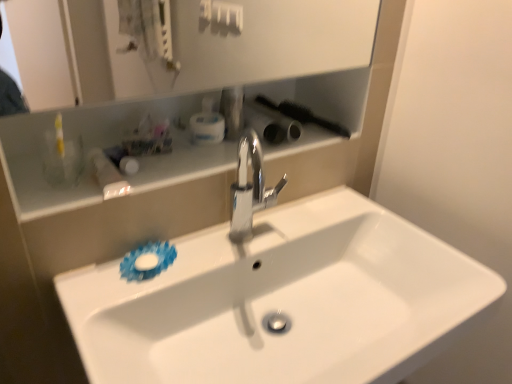
This screenshot has width=512, height=384. What do you see at coordinates (250, 187) in the screenshot?
I see `polished chrome faucet at center` at bounding box center [250, 187].

How much space does white plastic container at upper center, positioned as the second toiletry in left-to-right order, occupy horizontally?

It is 4.25 inches.

What is the approximate width of white glossy bottle at upper left, which appears as the 3th toiletry when viewed from the right?

10.17 inches.

The width and height of the screenshot is (512, 384). Identify the location of white glossy sink at center. (283, 301).

Locate an element on the screen. The height and width of the screenshot is (384, 512). metallic silver faucet at center, the 1th toiletry from the right is located at coordinates (232, 111).

What is the approximate width of metallic silver faucet at center, the 1th toiletry from the right?

→ metallic silver faucet at center, the 1th toiletry from the right, is 3.04 inches in width.

Find the location of a particular element. polished chrome faucet at center is located at coordinates (250, 187).

Is white glossy sink at center inside white glossy bottle at upper left, which appears as the 3th toiletry when viewed from the right?

No, white glossy bottle at upper left, which appears as the 3th toiletry when viewed from the right, does not contain white glossy sink at center.

From a real-world perspective, relative to white glossy sink at center, is white glossy bottle at upper left, which appears as the 3th toiletry when viewed from the right, vertically above or below?

white glossy bottle at upper left, which appears as the 3th toiletry when viewed from the right, is situated higher than white glossy sink at center in the real world.

In the scene shown: Looking at their sizes, would you say white glossy bottle at upper left, which appears as the 3th toiletry when viewed from the right, is wider or thinner than white glossy sink at center?

white glossy bottle at upper left, which appears as the 3th toiletry when viewed from the right, is thinner than white glossy sink at center.

At what (x,y) coordinates should I click in order to perform the action: click on sink that is below the white glossy bottle at upper left, placed as the 1th toiletry when sorted from left to right (from the image's perspective). Please return your answer as a coordinate pair (x, y). The width and height of the screenshot is (512, 384). Looking at the image, I should click on (283, 301).

Would you say white glossy sink at center is a long distance from metallic silver faucet at center, arranged as the third toiletry when viewed from the left?

No, white glossy sink at center is in close proximity to metallic silver faucet at center, arranged as the third toiletry when viewed from the left.

Is point (129, 327) positioned after point (236, 120)?

No, (129, 327) is in front of (236, 120).

Who is taller, white glossy sink at center or metallic silver faucet at center, arranged as the third toiletry when viewed from the left?

Standing taller between the two is white glossy sink at center.

Is white glossy sink at center facing away from metallic silver faucet at center, the 1th toiletry from the right?

No, white glossy sink at center is not facing away from metallic silver faucet at center, the 1th toiletry from the right.

Can you confirm if white glossy sink at center is bigger than white glossy shelf at upper center?

Indeed, white glossy sink at center has a larger size compared to white glossy shelf at upper center.

You are a GUI agent. You are given a task and a screenshot of the screen. Output one action in this format:
    pyautogui.click(x=<x>, y=<y>)
    Task: Click on the sink on the right of the white glossy shelf at upper center
    Image resolution: width=512 pixels, height=384 pixels.
    Given the screenshot: What is the action you would take?
    pyautogui.click(x=283, y=301)

Could you tell me if white glossy sink at center is facing white glossy shelf at upper center?

No.

Is white glossy sink at center situated inside white glossy shelf at upper center or outside?

white glossy sink at center lies outside white glossy shelf at upper center.

Visually, is white glossy sink at center positioned to the left or to the right of white glossy bottle at upper left, placed as the 1th toiletry when sorted from left to right?

From the image, it's evident that white glossy sink at center is to the right of white glossy bottle at upper left, placed as the 1th toiletry when sorted from left to right.

Between white glossy sink at center and white glossy bottle at upper left, which appears as the 3th toiletry when viewed from the right, which one has less height?

white glossy bottle at upper left, which appears as the 3th toiletry when viewed from the right.

How distant is white glossy sink at center from white glossy bottle at upper left, placed as the 1th toiletry when sorted from left to right?

They are 16.05 inches apart.

How many degrees apart are the facing directions of white glossy sink at center and white glossy bottle at upper left, which appears as the 3th toiletry when viewed from the right?

The angle between the facing direction of white glossy sink at center and the facing direction of white glossy bottle at upper left, which appears as the 3th toiletry when viewed from the right, is 1.68 degrees.

Is polished chrome faucet at center taller than white glossy sink at center?

No.

Considering the positions of objects polished chrome faucet at center and white glossy sink at center in the image provided, who is more to the right, polished chrome faucet at center or white glossy sink at center?

white glossy sink at center is more to the right.

Does point (238, 195) appear closer or farther from the camera than point (282, 215)?

Point (238, 195) appears to be closer to the viewer than point (282, 215).

Is white plastic container at upper center, positioned as the second toiletry in left-to-right order, inside white glossy sink at center?

No, white plastic container at upper center, positioned as the second toiletry in left-to-right order, is not a part of white glossy sink at center.

From the image's perspective, which one is positioned higher, white glossy sink at center or white plastic container at upper center, arranged as the 2th toiletry when viewed from the right?

white plastic container at upper center, arranged as the 2th toiletry when viewed from the right, from the image's perspective.

From a real-world perspective, who is located higher, white glossy sink at center or white plastic container at upper center, arranged as the 2th toiletry when viewed from the right?

white plastic container at upper center, arranged as the 2th toiletry when viewed from the right.

How many degrees apart are the facing directions of white glossy sink at center and white plastic container at upper center, positioned as the second toiletry in left-to-right order?

The angle between the facing direction of white glossy sink at center and the facing direction of white plastic container at upper center, positioned as the second toiletry in left-to-right order, is 5.04 degrees.

Considering the positions of objects metallic silver faucet at center, arranged as the third toiletry when viewed from the left, and white glossy shelf at upper center in the image provided, who is in front, metallic silver faucet at center, arranged as the third toiletry when viewed from the left, or white glossy shelf at upper center?

white glossy shelf at upper center.

Is metallic silver faucet at center, arranged as the third toiletry when viewed from the left, looking in the opposite direction of white glossy shelf at upper center?

No, white glossy shelf at upper center is not at the back of metallic silver faucet at center, arranged as the third toiletry when viewed from the left.

Is metallic silver faucet at center, arranged as the third toiletry when viewed from the left, taller than white glossy shelf at upper center?

Correct, metallic silver faucet at center, arranged as the third toiletry when viewed from the left, is much taller as white glossy shelf at upper center.

Is metallic silver faucet at center, the 1th toiletry from the right, positioned far away from white glossy shelf at upper center?

Actually, metallic silver faucet at center, the 1th toiletry from the right, and white glossy shelf at upper center are a little close together.

You are a GUI agent. You are given a task and a screenshot of the screen. Output one action in this format:
    pyautogui.click(x=<x>, y=<y>)
    Task: Click on the sink beneath the white glossy bottle at upper left, which appears as the 3th toiletry when viewed from the right (from a real-world perspective)
    
    Given the screenshot: What is the action you would take?
    pyautogui.click(x=283, y=301)

Locate an element on the screen. Image resolution: width=512 pixels, height=384 pixels. the 3rd toiletry positioned above the white glossy sink at center (from a real-world perspective) is located at coordinates (232, 111).

Considering their positions, is white glossy sink at center positioned closer to white glossy bottle at upper left, placed as the 1th toiletry when sorted from left to right, than polished chrome faucet at center?

Among the two, polished chrome faucet at center is located nearer to white glossy bottle at upper left, placed as the 1th toiletry when sorted from left to right.

Based on their spatial positions, is polished chrome faucet at center or white glossy sink at center closer to white glossy bottle at upper left, placed as the 1th toiletry when sorted from left to right?

Among the two, polished chrome faucet at center is located nearer to white glossy bottle at upper left, placed as the 1th toiletry when sorted from left to right.

When comparing their distances from white glossy bottle at upper left, placed as the 1th toiletry when sorted from left to right, does white glossy sink at center or white plastic container at upper center, positioned as the second toiletry in left-to-right order, seem further?

Among the two, white glossy sink at center is located further to white glossy bottle at upper left, placed as the 1th toiletry when sorted from left to right.

Considering their positions, is white glossy bottle at upper left, which appears as the 3th toiletry when viewed from the right, positioned further to metallic silver faucet at center, the 1th toiletry from the right, than white glossy sink at center?

The object further to metallic silver faucet at center, the 1th toiletry from the right, is white glossy sink at center.

Which object lies nearer to the anchor point white glossy shelf at upper center, white glossy sink at center or metallic silver faucet at center, the 1th toiletry from the right?

Based on the image, metallic silver faucet at center, the 1th toiletry from the right, appears to be nearer to white glossy shelf at upper center.

Based on their spatial positions, is metallic silver faucet at center, the 1th toiletry from the right, or white glossy shelf at upper center closer to polished chrome faucet at center?

Based on the image, metallic silver faucet at center, the 1th toiletry from the right, appears to be nearer to polished chrome faucet at center.

When comparing their distances from white glossy bottle at upper left, which appears as the 3th toiletry when viewed from the right, does white plastic container at upper center, positioned as the second toiletry in left-to-right order, or polished chrome faucet at center seem further?

Among the two, polished chrome faucet at center is located further to white glossy bottle at upper left, which appears as the 3th toiletry when viewed from the right.

Which object lies further to the anchor point white glossy shelf at upper center, white glossy bottle at upper left, which appears as the 3th toiletry when viewed from the right, or white plastic container at upper center, arranged as the 2th toiletry when viewed from the right?

Among the two, white glossy bottle at upper left, which appears as the 3th toiletry when viewed from the right, is located further to white glossy shelf at upper center.

Locate an element on the screen. This screenshot has height=384, width=512. shelve between white glossy bottle at upper left, which appears as the 3th toiletry when viewed from the right, and polished chrome faucet at center is located at coordinates (39, 170).

You are a GUI agent. You are given a task and a screenshot of the screen. Output one action in this format:
    pyautogui.click(x=<x>, y=<y>)
    Task: Click on the shelve situated between white glossy bottle at upper left, placed as the 1th toiletry when sorted from left to right, and metallic silver faucet at center, the 1th toiletry from the right, from left to right
    Image resolution: width=512 pixels, height=384 pixels.
    Given the screenshot: What is the action you would take?
    pyautogui.click(x=39, y=170)

Locate an element on the screen. shelve located between white glossy sink at center and white plastic container at upper center, arranged as the 2th toiletry when viewed from the right, in the depth direction is located at coordinates (39, 170).

Image resolution: width=512 pixels, height=384 pixels. I want to click on toiletry between white glossy bottle at upper left, which appears as the 3th toiletry when viewed from the right, and metallic silver faucet at center, the 1th toiletry from the right, in the horizontal direction, so click(x=207, y=124).